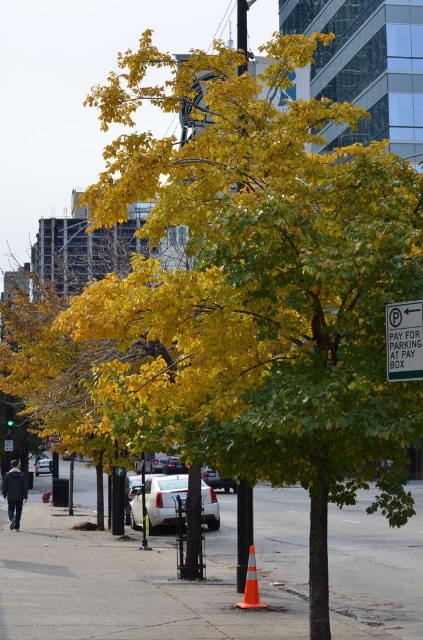
You are a pedestrian standing on the sidewalk and see the dark gray jacket at lower left and the orange reflective traffic cone at center. Which object is closer to you?

The dark gray jacket at lower left is closer to you because the orange reflective traffic cone at center is behind it.